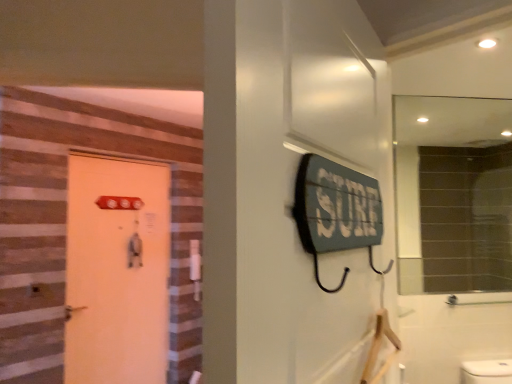
What do you see at coordinates (117, 271) in the screenshot? I see `matte orange door at left` at bounding box center [117, 271].

Image resolution: width=512 pixels, height=384 pixels. Identify the location of matte orange door at left. (117, 271).

The width and height of the screenshot is (512, 384). I want to click on matte glass mirror at upper right, so click(x=453, y=193).

The image size is (512, 384). What do you see at coordinates (453, 193) in the screenshot? I see `matte glass mirror at upper right` at bounding box center [453, 193].

Where is `matte orange door at left`? The height and width of the screenshot is (384, 512). matte orange door at left is located at coordinates (117, 271).

Visually, is matte orange door at left positioned to the left or to the right of matte glass mirror at upper right?

matte orange door at left is positioned on matte glass mirror at upper right's left side.

Between matte orange door at left and matte glass mirror at upper right, which one is positioned behind?

matte orange door at left is behind.

Which point is more distant from viewer, (169, 219) or (450, 255)?

Positioned behind is point (450, 255).

From the image's perspective, between matte orange door at left and matte glass mirror at upper right, who is located below?

matte orange door at left.

From a real-world perspective, is matte orange door at left positioned above or below matte glass mirror at upper right?

From a real-world perspective, matte orange door at left is physically below matte glass mirror at upper right.

Can you confirm if matte orange door at left is thinner than matte glass mirror at upper right?

No.

Does matte orange door at left have a lesser height compared to matte glass mirror at upper right?

In fact, matte orange door at left may be taller than matte glass mirror at upper right.

Between matte orange door at left and matte glass mirror at upper right, which one has smaller size?

matte glass mirror at upper right is smaller.

Is matte orange door at left not within matte glass mirror at upper right?

Indeed, matte orange door at left is completely outside matte glass mirror at upper right.

Is matte orange door at left far from matte glass mirror at upper right?

matte orange door at left is far away from matte glass mirror at upper right.

Is matte orange door at left facing towards matte glass mirror at upper right?

Yes, matte orange door at left faces towards matte glass mirror at upper right.

Measure the distance from matte orange door at left to matte glass mirror at upper right.

matte orange door at left is 2.39 meters from matte glass mirror at upper right.

You are a GUI agent. You are given a task and a screenshot of the screen. Output one action in this format:
    pyautogui.click(x=<x>, y=<y>)
    Task: Click on the door located below the matte glass mirror at upper right (from the image's perspective)
    
    Given the screenshot: What is the action you would take?
    pyautogui.click(x=117, y=271)

Considering the relative positions of matte glass mirror at upper right and matte orange door at left in the image provided, is matte glass mirror at upper right to the left or to the right of matte orange door at left?

Based on their positions, matte glass mirror at upper right is located to the right of matte orange door at left.

Relative to matte orange door at left, is matte glass mirror at upper right in front or behind?

In the image, matte glass mirror at upper right appears in front of matte orange door at left.

Considering the points (506, 208) and (82, 337), which point is behind, point (506, 208) or point (82, 337)?

The point (506, 208) is farther from the camera.

From the image's perspective, which one is positioned higher, matte glass mirror at upper right or matte orange door at left?

matte glass mirror at upper right appears higher in the image.

From a real-world perspective, is matte glass mirror at upper right physically below matte orange door at left?

No.

Considering the sizes of matte glass mirror at upper right and matte orange door at left in the image, is matte glass mirror at upper right wider or thinner than matte orange door at left?

Clearly, matte glass mirror at upper right has less width compared to matte orange door at left.

From the picture: Who is shorter, matte glass mirror at upper right or matte orange door at left?

With less height is matte glass mirror at upper right.

Which of these two, matte glass mirror at upper right or matte orange door at left, is smaller?

matte glass mirror at upper right is smaller.

Is matte orange door at left located within matte glass mirror at upper right?

No, matte glass mirror at upper right does not contain matte orange door at left.

Based on the photo, is matte glass mirror at upper right in contact with matte orange door at left?

There is a gap between matte glass mirror at upper right and matte orange door at left.

Looking at this image, is matte orange door at left at the back of matte glass mirror at upper right?

That's not correct — matte glass mirror at upper right is not looking away from matte orange door at left.

Identify the location of door directly beneath the matte glass mirror at upper right (from a real-world perspective). The image size is (512, 384). (117, 271).

The width and height of the screenshot is (512, 384). I want to click on mirror that appears above the matte orange door at left (from a real-world perspective), so click(453, 193).

I want to click on door below the matte glass mirror at upper right (from the image's perspective), so click(x=117, y=271).